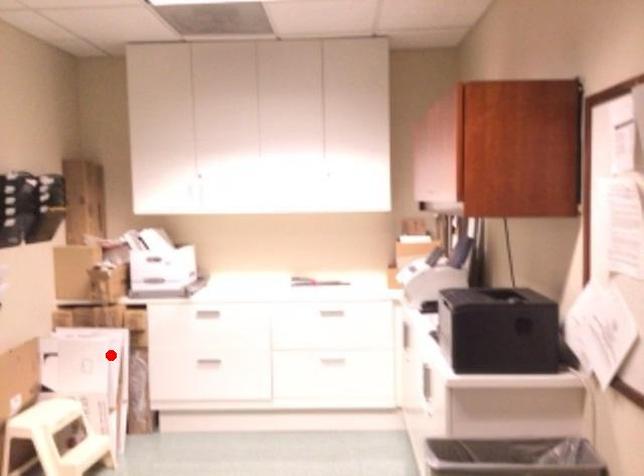
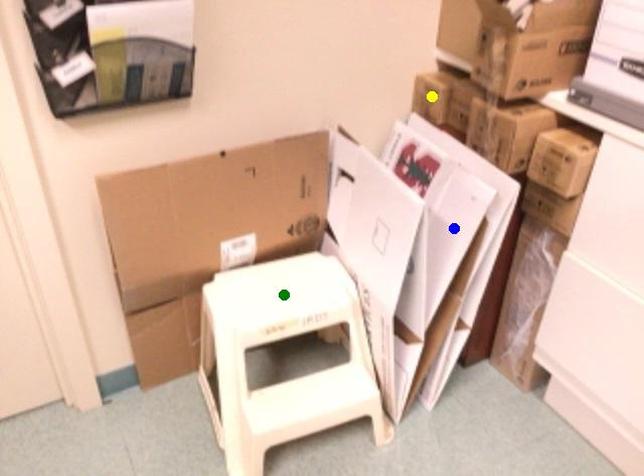
Question: I am providing you with two images of the same scene from different viewpoints. A red point is marked on the first image. You are given multiple points on the second image. Which mark in image 2 goes with the point in image 1?

Choices:
 (A) blue point
 (B) green point
 (C) yellow point

Answer: (A)